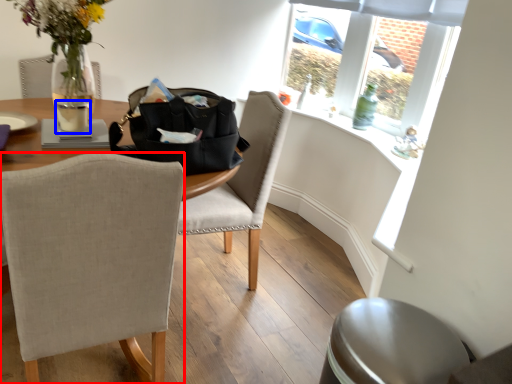
Question: Which object appears closest to the camera in this image, chair (highlighted by a red box) or beverage (highlighted by a blue box)?

Choices:
 (A) chair
 (B) beverage

Answer: (A)